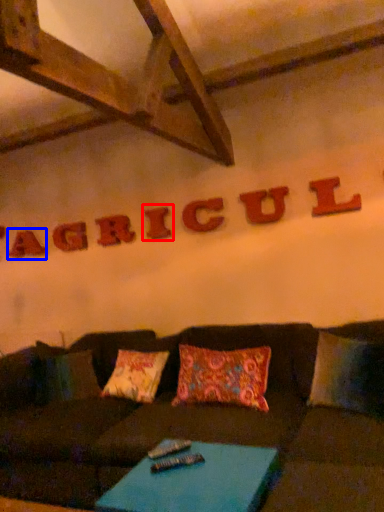
Question: Which point is closer to the camera, letter (highlighted by a red box) or letter (highlighted by a blue box)?

Choices:
 (A) letter
 (B) letter

Answer: (A)